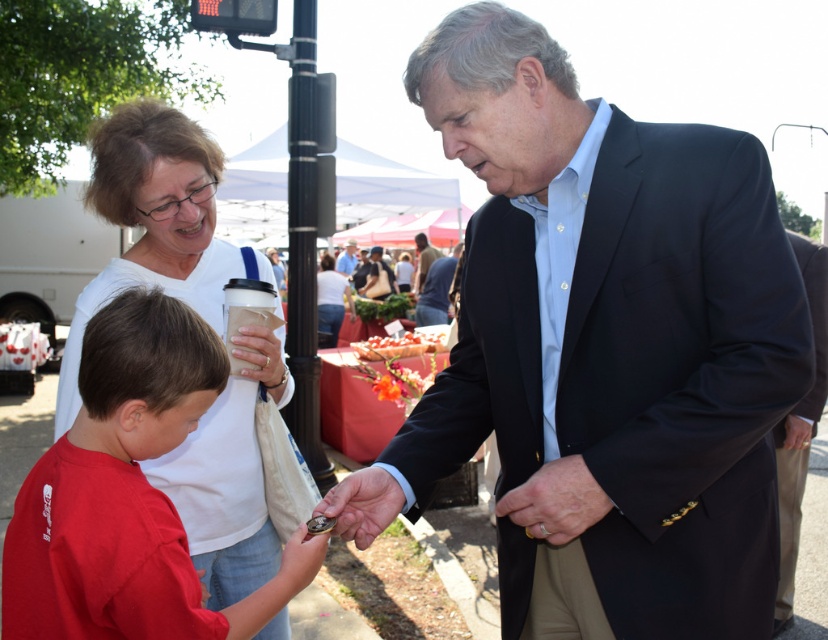
You are at a community event and see two men in suits. One is wearing a matte black suit at center and the other a dark suit jacket at center. Which one is positioned to the right?

The matte black suit at center is positioned to the right of the dark suit jacket at center.